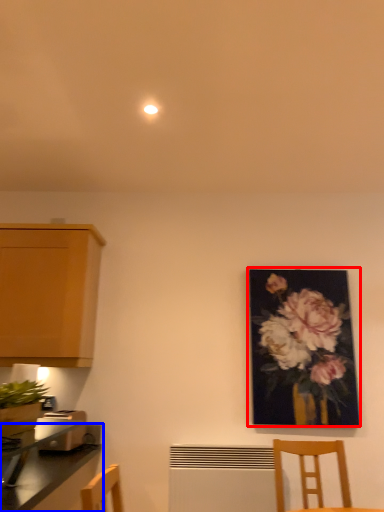
Question: Which point is closer to the camera, picture frame (highlighted by a red box) or countertop (highlighted by a blue box)?

Choices:
 (A) picture frame
 (B) countertop

Answer: (B)